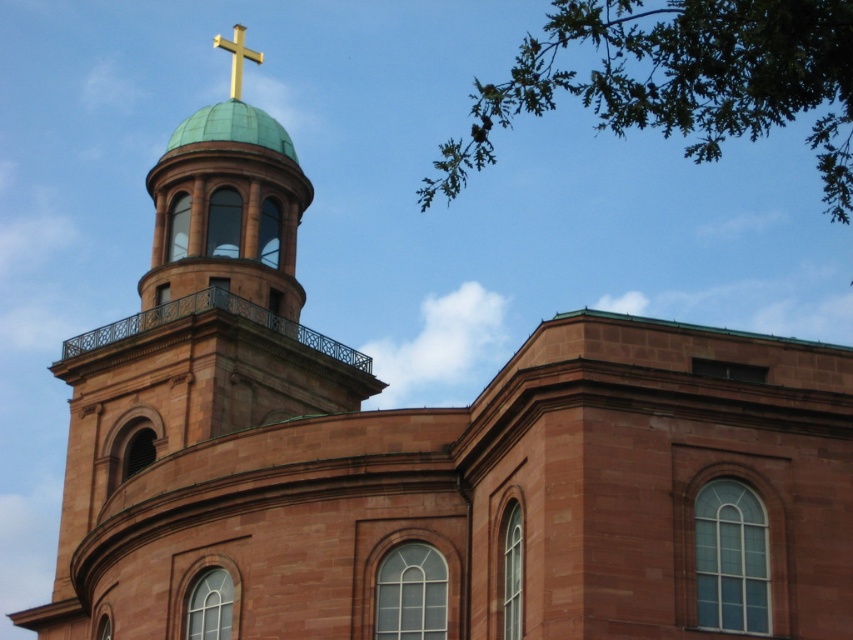
Does green leafy branch at upper right have a greater height compared to gold metallic cross at top?

Indeed, green leafy branch at upper right has a greater height compared to gold metallic cross at top.

Is point (683, 83) more distant than point (236, 49)?

That is False.

What do you see at coordinates (682, 81) in the screenshot?
I see `green leafy branch at upper right` at bounding box center [682, 81].

I want to click on green leafy branch at upper right, so click(682, 81).